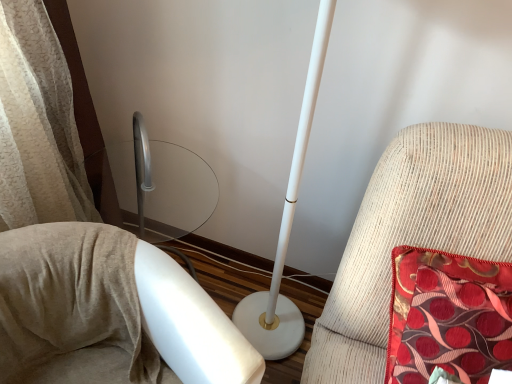
This screenshot has width=512, height=384. Find the location of `white glossy floor lamp at center, which is the 1th furniture from left to right`. white glossy floor lamp at center, which is the 1th furniture from left to right is located at coordinates (110, 308).

In order to face white glossy floor lamp at center, the 2th furniture positioned from the right, should I rotate leftwards or rightwards?

A 17.242 degree turn to the left will do.

Image resolution: width=512 pixels, height=384 pixels. Describe the element at coordinates (110, 308) in the screenshot. I see `white glossy floor lamp at center, which is the 1th furniture from left to right` at that location.

This screenshot has height=384, width=512. What do you see at coordinates (412, 235) in the screenshot?
I see `red satin cushion at right, which is the first furniture from right to left` at bounding box center [412, 235].

Identify the location of red satin cushion at right, which is the first furniture from right to left. (412, 235).

At what (x,y) coordinates should I click in order to perform the action: click on white glossy floor lamp at center, the 2th furniture positioned from the right. Please return your answer as a coordinate pair (x, y). This screenshot has width=512, height=384. Looking at the image, I should click on (110, 308).

Is red satin cushion at right, positioned as the 2th furniture in left-to-right order, to the left or to the right of white glossy floor lamp at center, the 2th furniture positioned from the right, in the image?

red satin cushion at right, positioned as the 2th furniture in left-to-right order, is positioned on white glossy floor lamp at center, the 2th furniture positioned from the right,'s right side.

Considering the positions of objects red satin cushion at right, which is the first furniture from right to left, and white glossy floor lamp at center, which is the 1th furniture from left to right, in the image provided, who is behind, red satin cushion at right, which is the first furniture from right to left, or white glossy floor lamp at center, which is the 1th furniture from left to right,?

red satin cushion at right, which is the first furniture from right to left.

Does point (423, 154) appear closer or farther from the camera than point (188, 357)?

Point (423, 154) is positioned farther from the camera compared to point (188, 357).

From the image's perspective, is red satin cushion at right, positioned as the 2th furniture in left-to-right order, above white glossy floor lamp at center, which is the 1th furniture from left to right?

Yes, from the image's perspective, red satin cushion at right, positioned as the 2th furniture in left-to-right order, is on top of white glossy floor lamp at center, which is the 1th furniture from left to right.

Looking at this image, from a real-world perspective, which is physically above, red satin cushion at right, which is the first furniture from right to left, or white glossy floor lamp at center, the 2th furniture positioned from the right?

In real-world perspective, red satin cushion at right, which is the first furniture from right to left, is above.

Between red satin cushion at right, which is the first furniture from right to left, and white glossy floor lamp at center, the 2th furniture positioned from the right, which one has larger width?

white glossy floor lamp at center, the 2th furniture positioned from the right.

Considering the sizes of objects red satin cushion at right, positioned as the 2th furniture in left-to-right order, and white glossy floor lamp at center, which is the 1th furniture from left to right, in the image provided, who is shorter, red satin cushion at right, positioned as the 2th furniture in left-to-right order, or white glossy floor lamp at center, which is the 1th furniture from left to right,?

Standing shorter between the two is red satin cushion at right, positioned as the 2th furniture in left-to-right order.

Can you confirm if red satin cushion at right, positioned as the 2th furniture in left-to-right order, is bigger than white glossy floor lamp at center, the 2th furniture positioned from the right?

No.

Does red satin cushion at right, positioned as the 2th furniture in left-to-right order, contain white glossy floor lamp at center, the 2th furniture positioned from the right?

No, white glossy floor lamp at center, the 2th furniture positioned from the right, is located outside of red satin cushion at right, positioned as the 2th furniture in left-to-right order.

In the scene shown: Is the surface of red satin cushion at right, which is the first furniture from right to left, in direct contact with white glossy floor lamp at center, the 2th furniture positioned from the right?

No, red satin cushion at right, which is the first furniture from right to left, is not in contact with white glossy floor lamp at center, the 2th furniture positioned from the right.

Is red satin cushion at right, positioned as the 2th furniture in left-to-right order, looking in the opposite direction of white glossy floor lamp at center, which is the 1th furniture from left to right?

That's not correct — red satin cushion at right, positioned as the 2th furniture in left-to-right order, is not looking away from white glossy floor lamp at center, which is the 1th furniture from left to right.

What's the angular difference between red satin cushion at right, which is the first furniture from right to left, and white glossy floor lamp at center, the 2th furniture positioned from the right,'s facing directions?

red satin cushion at right, which is the first furniture from right to left, and white glossy floor lamp at center, the 2th furniture positioned from the right, are facing 63.2 degrees away from each other.

At what (x,y) coordinates should I click in order to perform the action: click on furniture above the white glossy floor lamp at center, the 2th furniture positioned from the right (from the image's perspective). Please return your answer as a coordinate pair (x, y). This screenshot has width=512, height=384. Looking at the image, I should click on (412, 235).

Considering the relative positions of white glossy floor lamp at center, which is the 1th furniture from left to right, and red satin cushion at right, which is the first furniture from right to left, in the image provided, is white glossy floor lamp at center, which is the 1th furniture from left to right, to the left of red satin cushion at right, which is the first furniture from right to left, from the viewer's perspective?

Correct, you'll find white glossy floor lamp at center, which is the 1th furniture from left to right, to the left of red satin cushion at right, which is the first furniture from right to left.

Which object is more forward, white glossy floor lamp at center, the 2th furniture positioned from the right, or red satin cushion at right, which is the first furniture from right to left?

white glossy floor lamp at center, the 2th furniture positioned from the right, is more forward.

Considering the points (42, 228) and (354, 265), which point is behind, point (42, 228) or point (354, 265)?

Positioned behind is point (354, 265).

Consider the image. From the image's perspective, is white glossy floor lamp at center, which is the 1th furniture from left to right, on red satin cushion at right, positioned as the 2th furniture in left-to-right order?

No, from the image's perspective, white glossy floor lamp at center, which is the 1th furniture from left to right, is not above red satin cushion at right, positioned as the 2th furniture in left-to-right order.

From a real-world perspective, is white glossy floor lamp at center, which is the 1th furniture from left to right, physically below red satin cushion at right, which is the first furniture from right to left?

Yes.

Which object is wider, white glossy floor lamp at center, the 2th furniture positioned from the right, or red satin cushion at right, positioned as the 2th furniture in left-to-right order?

With larger width is white glossy floor lamp at center, the 2th furniture positioned from the right.

Between white glossy floor lamp at center, which is the 1th furniture from left to right, and red satin cushion at right, which is the first furniture from right to left, which one has more height?

white glossy floor lamp at center, which is the 1th furniture from left to right.

Considering the sizes of objects white glossy floor lamp at center, which is the 1th furniture from left to right, and red satin cushion at right, which is the first furniture from right to left, in the image provided, who is smaller, white glossy floor lamp at center, which is the 1th furniture from left to right, or red satin cushion at right, which is the first furniture from right to left,?

With smaller size is red satin cushion at right, which is the first furniture from right to left.

Choose the correct answer: Is white glossy floor lamp at center, the 2th furniture positioned from the right, inside red satin cushion at right, which is the first furniture from right to left, or outside it?

white glossy floor lamp at center, the 2th furniture positioned from the right, cannot be found inside red satin cushion at right, which is the first furniture from right to left.

Is white glossy floor lamp at center, which is the 1th furniture from left to right, touching red satin cushion at right, positioned as the 2th furniture in left-to-right order?

No, white glossy floor lamp at center, which is the 1th furniture from left to right, is not beside red satin cushion at right, positioned as the 2th furniture in left-to-right order.

Could you tell me if white glossy floor lamp at center, which is the 1th furniture from left to right, is turned towards red satin cushion at right, positioned as the 2th furniture in left-to-right order?

No.

Can you tell me how much white glossy floor lamp at center, the 2th furniture positioned from the right, and red satin cushion at right, positioned as the 2th furniture in left-to-right order, differ in facing direction?

white glossy floor lamp at center, the 2th furniture positioned from the right, and red satin cushion at right, positioned as the 2th furniture in left-to-right order, are facing 63.2 degrees away from each other.

Where is `furniture that is above the white glossy floor lamp at center, the 2th furniture positioned from the right (from a real-world perspective)`? The height and width of the screenshot is (384, 512). furniture that is above the white glossy floor lamp at center, the 2th furniture positioned from the right (from a real-world perspective) is located at coordinates (412, 235).

The width and height of the screenshot is (512, 384). What are the coordinates of `furniture that appears on the right of white glossy floor lamp at center, the 2th furniture positioned from the right` in the screenshot? It's located at (412, 235).

Where is `furniture below the red satin cushion at right, which is the first furniture from right to left (from a real-world perspective)`? The height and width of the screenshot is (384, 512). furniture below the red satin cushion at right, which is the first furniture from right to left (from a real-world perspective) is located at coordinates (110, 308).